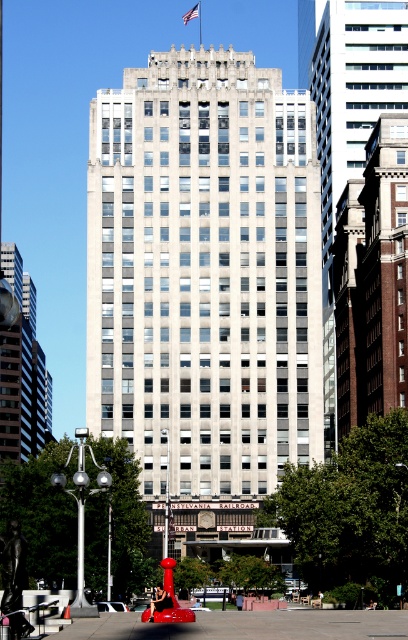
From the picture: You are standing in front of the building and want to take a photo that includes both the glassy reflective tower at left and the red fabric flag at upper center. Based on their widths, which object should you focus on to ensure both are fully visible in the frame?

The glassy reflective tower at left might be wider than the red fabric flag at upper center, so focusing on the tower would ensure both are visible as it may occupy more space.